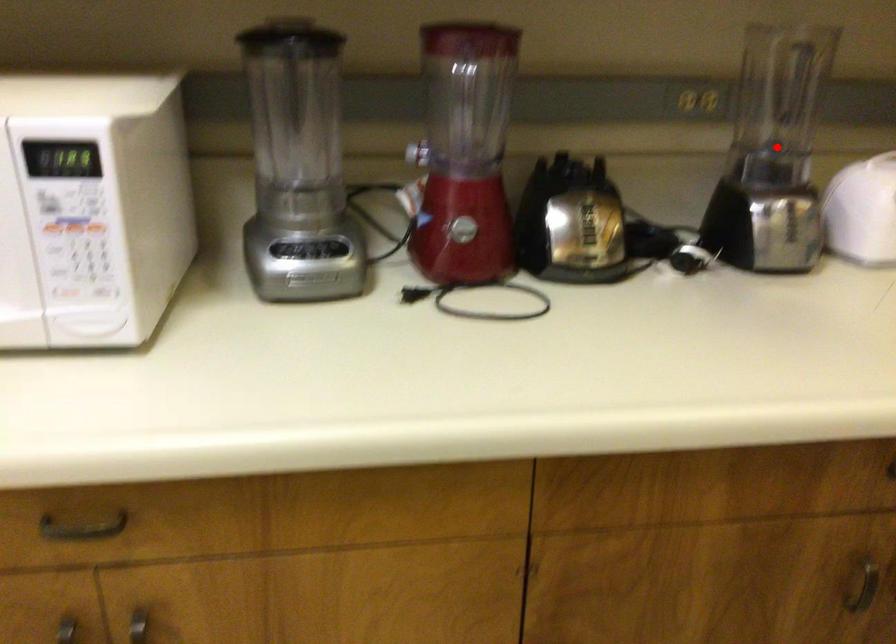
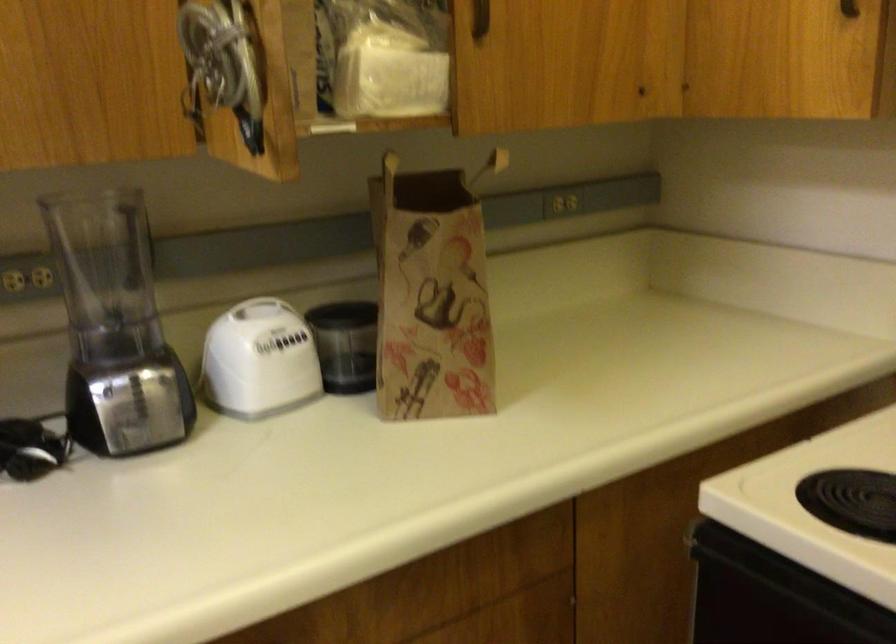
Where in the second image is the point corresponding to the highlighted location from the first image?

(115, 327)